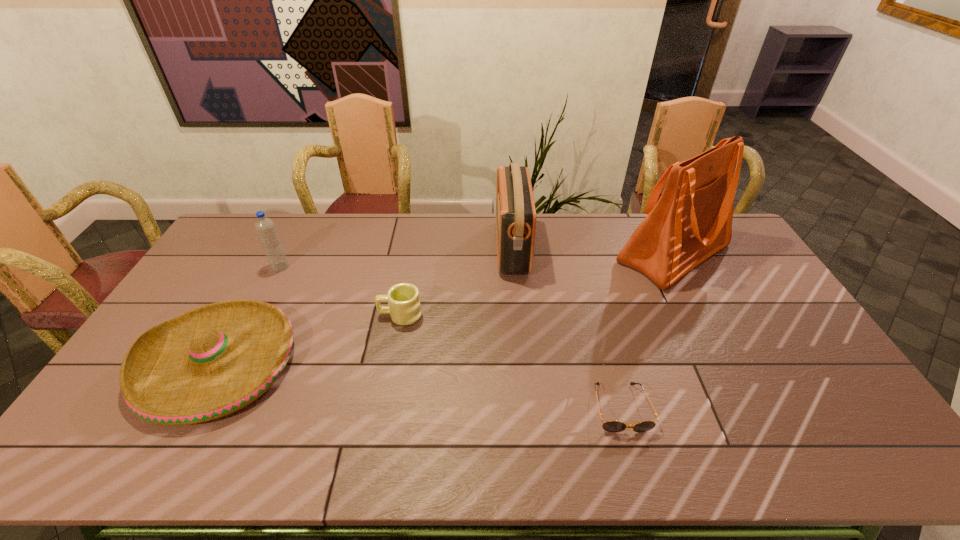
At what (x,y) coordinates should I click in order to perform the action: click on vacant point located between the sunglasses and the third object from right to left. Please return your answer as a coordinate pair (x, y). This screenshot has height=540, width=960. Looking at the image, I should click on (566, 328).

Identify the location of vacant area that lies between the second tallest object and the fourth tallest object. This screenshot has width=960, height=540. (365, 305).

Image resolution: width=960 pixels, height=540 pixels. I want to click on empty location between the shopping bag and the second object from right to left, so click(x=647, y=330).

Identify the location of free space that is in between the radio receiver and the fifth tallest object. (456, 281).

Image resolution: width=960 pixels, height=540 pixels. I want to click on free spot between the water bottle and the rightmost object, so click(x=477, y=260).

At what (x,y) coordinates should I click in order to perform the action: click on vacant area that lies between the radio receiver and the shopping bag. Please return your answer as a coordinate pair (x, y). The height and width of the screenshot is (540, 960). Looking at the image, I should click on (592, 251).

Image resolution: width=960 pixels, height=540 pixels. Find the location of `free area in between the third object from right to left and the second object from right to left`. free area in between the third object from right to left and the second object from right to left is located at coordinates (566, 328).

This screenshot has height=540, width=960. I want to click on empty space that is in between the shopping bag and the sombrero, so click(445, 308).

At what (x,y) coordinates should I click in order to perform the action: click on vacant space that is in between the radio receiver and the tallest object. Please return your answer as a coordinate pair (x, y). This screenshot has width=960, height=540. Looking at the image, I should click on tap(592, 251).

You are a GUI agent. You are given a task and a screenshot of the screen. Output one action in this format:
    pyautogui.click(x=<x>, y=<y>)
    Task: Click on the free space between the rightmost object and the radio receiver
    The image size is (960, 540).
    Given the screenshot: What is the action you would take?
    pyautogui.click(x=592, y=251)